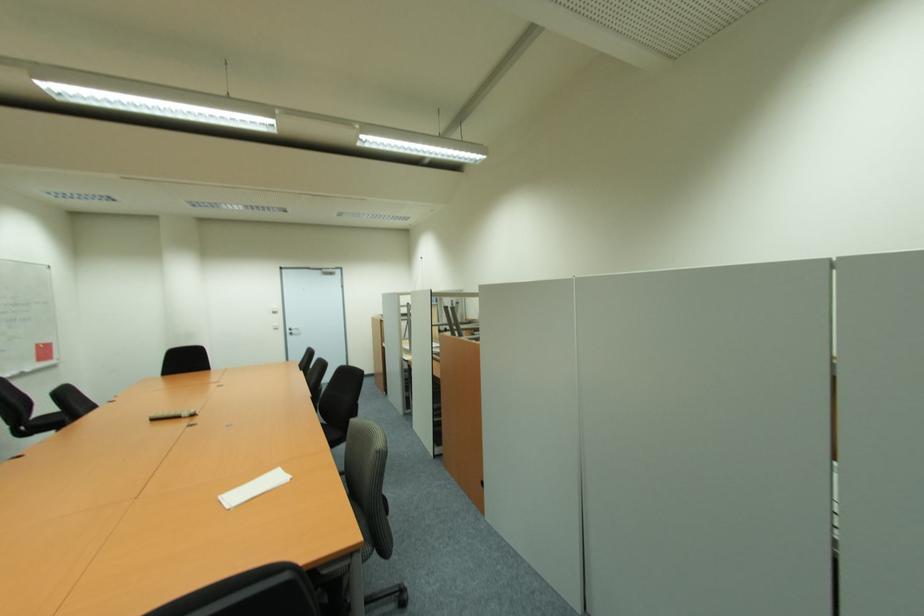
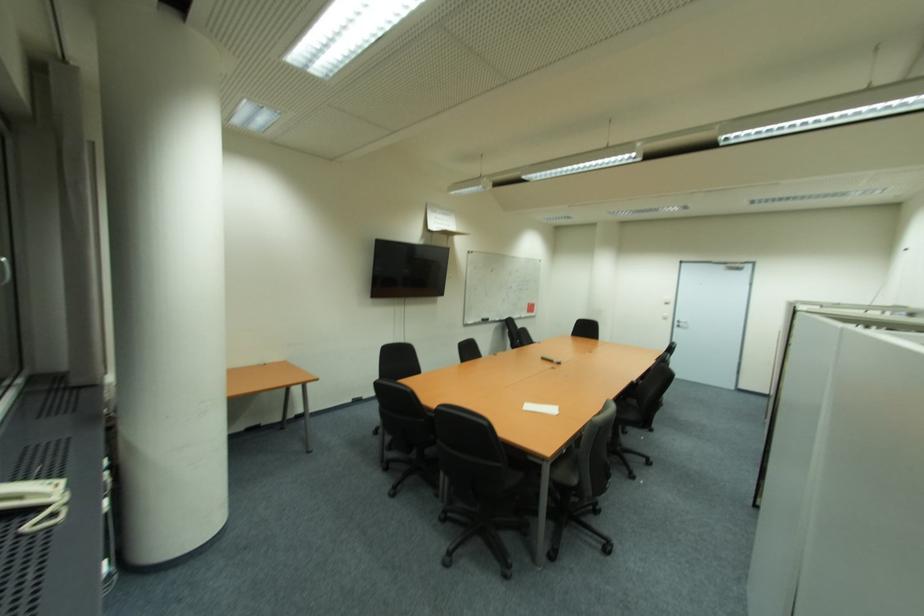
Locate, in the second image, the point that corresponds to (x=297, y=331) in the first image.

(686, 325)